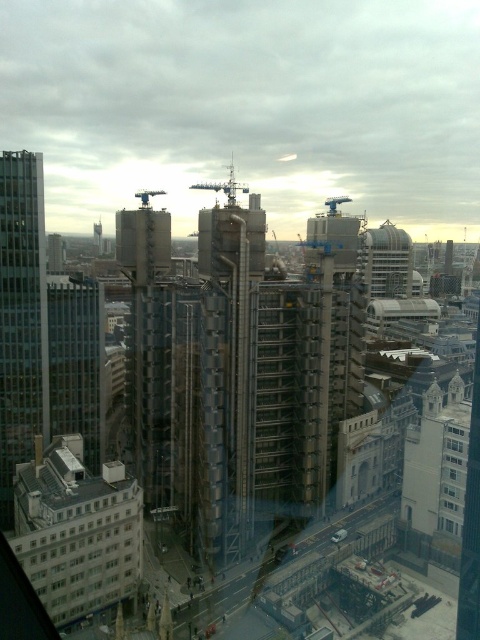
Question: Can you confirm if glassy reflective skyscraper at left is positioned below clear glass window at lower left?

Choices:
 (A) yes
 (B) no

Answer: (B)

Question: Which object is farther from the camera taking this photo?

Choices:
 (A) clear glass windows at center
 (B) clear glass window at lower left
 (C) glassy reflective skyscraper at left

Answer: (C)

Question: Which is nearer to the clear glass windows at center?

Choices:
 (A) glassy reflective skyscraper at left
 (B) clear glass window at lower left

Answer: (B)

Question: Is concrete textured building at center further to camera compared to metallic gray crane at center?

Choices:
 (A) yes
 (B) no

Answer: (B)

Question: Which object appears farthest from the camera in this image?

Choices:
 (A) glassy steel tower at upper right
 (B) clear glass windows at center

Answer: (A)

Question: Is glassy steel tower at upper right wider than clear glass windows at center?

Choices:
 (A) yes
 (B) no

Answer: (A)